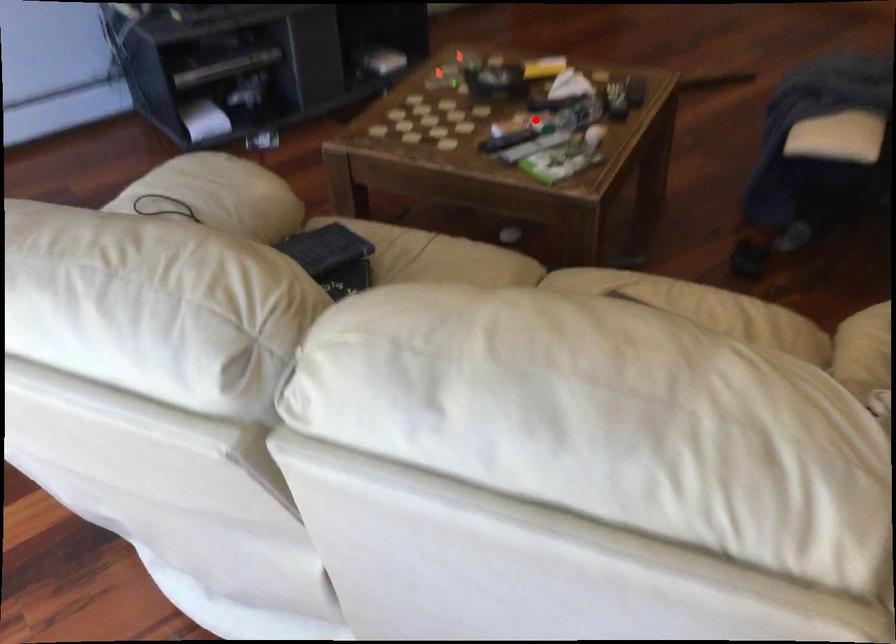
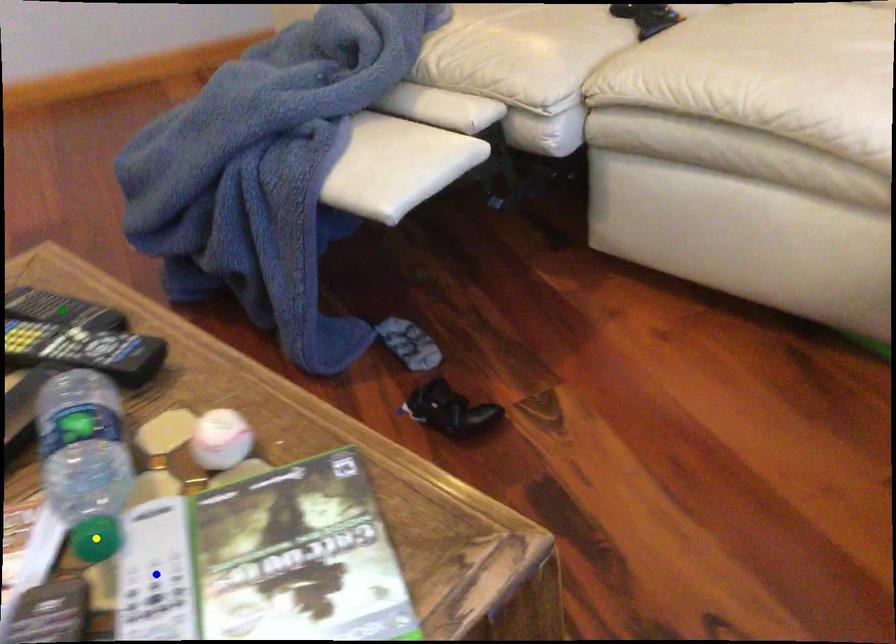
Question: I am providing you with two images of the same scene from different viewpoints. A red point is marked on the first image. You are given multiple points on the second image. In image 2, which mark is for the same physical point as the one in image 1?

Choices:
 (A) blue point
 (B) green point
 (C) yellow point

Answer: (C)